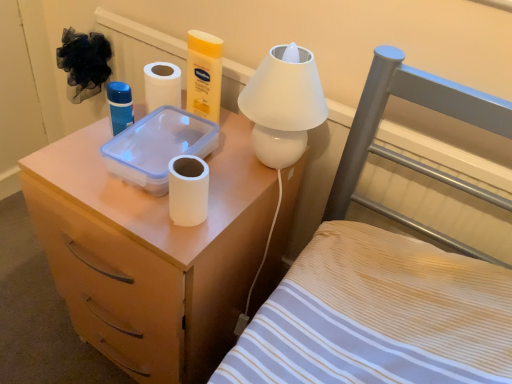
You are a GUI agent. You are given a task and a screenshot of the screen. Output one action in this format:
    pyautogui.click(x=<x>, y=<y>)
    Task: Click on the free space on the front side of white matte toilet paper at center
    
    Given the screenshot: What is the action you would take?
    [173, 246]